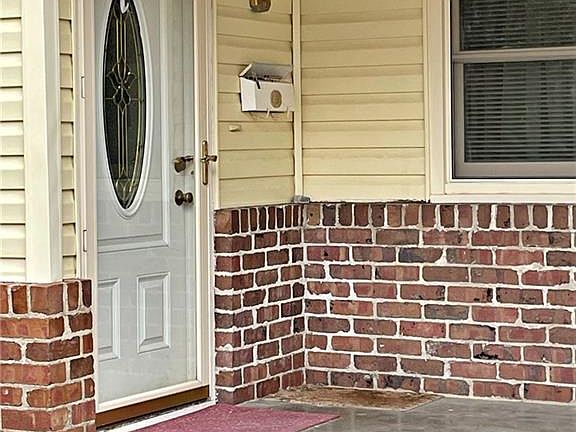
Locate an element on the screen. This screenshot has width=576, height=432. glass is located at coordinates (119, 97).